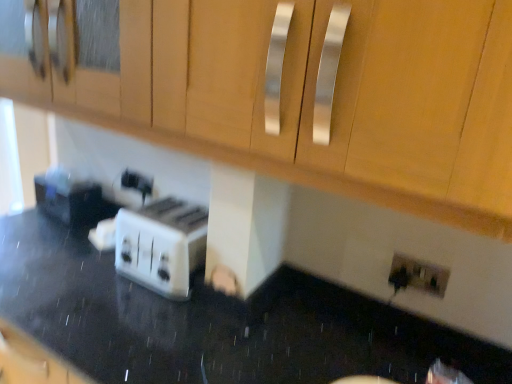
Image resolution: width=512 pixels, height=384 pixels. I want to click on vacant space positioned to the left of white plastic toaster at center, so click(x=59, y=274).